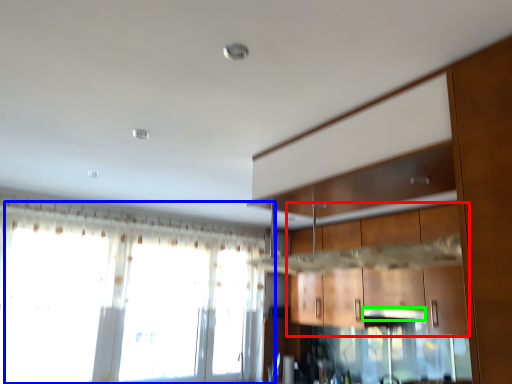
Question: Which object is positioned farthest from cabinetry (highlighted by a red box)? Select from window (highlighted by a blue box) and exhaust hood (highlighted by a green box).

Choices:
 (A) window
 (B) exhaust hood

Answer: (A)